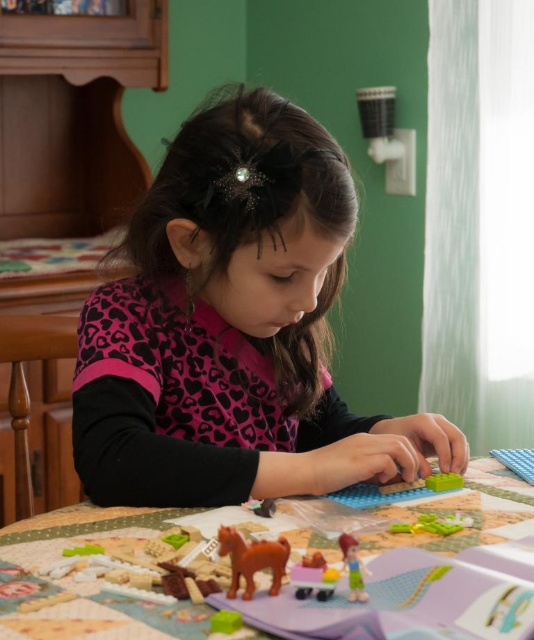
You are standing in the room where the girl is playing with building blocks. There are two points marked on the table where her toys are placed. The first point is at coordinates point [255,557] and the second is at point [352,540]. If you want to pick up the toy closest to you, which point should you reach for?

A: Point [255,557] is closer to the camera than point [352,540], so you should reach for the toy at point [255,557].

You are a toy organizer who needs to place both the translucent plastic toy car at lower center and the green matte block at lower center into a storage box. The box has a width of 10 inches. Can both items fit side by side in the box without overlapping?

The translucent plastic toy car at lower center and green matte block at lower center are 10.61 inches apart from each other. Since the distance between them is greater than the box width of 10 inches, they cannot fit side by side in the box without overlapping.

You are a parent trying to organize the toys on the table. You need to place the translucent plastic toy car at lower center and the green matte block at lower center into a storage box. If the box can only hold one of them, which toy should you choose based on size?

The translucent plastic toy car at lower center is larger in size than the green matte block at lower center, so you should choose the translucent plastic toy car at lower center to place into the storage box if it can only hold one.